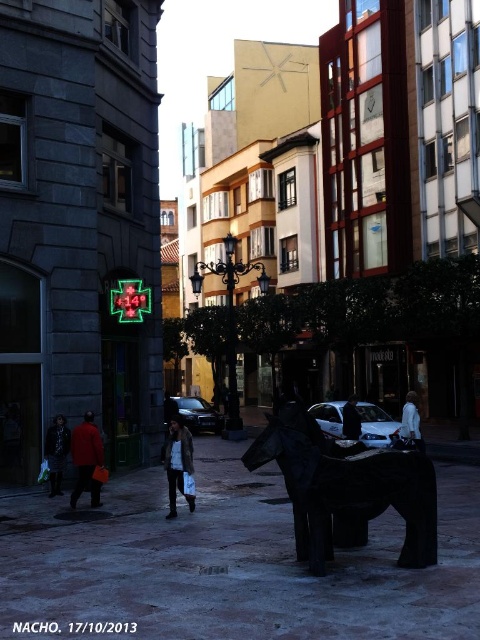
Is matte red coat at lower left above white matte coat at lower right?

Correct, matte red coat at lower left is located above white matte coat at lower right.

Can you confirm if matte red coat at lower left is positioned to the right of white matte coat at lower right?

In fact, matte red coat at lower left is to the left of white matte coat at lower right.

Is point (95, 449) farther from viewer compared to point (422, 449)?

That is False.

The image size is (480, 640). What are the coordinates of `matte red coat at lower left` in the screenshot? It's located at (86, 460).

Does matte red coat at lower left have a smaller size compared to leather jacket at center?

Correct, matte red coat at lower left occupies less space than leather jacket at center.

Does point (97, 492) come closer to viewer compared to point (179, 436)?

No.

Where is `matte red coat at lower left`? This screenshot has height=640, width=480. matte red coat at lower left is located at coordinates (86, 460).

Based on the photo, who is shorter, white matte coat at lower right or dark blue leather jacket at center?

Standing shorter between the two is dark blue leather jacket at center.

Who is taller, white matte coat at lower right or dark blue leather jacket at center?

white matte coat at lower right is taller.

In order to click on white matte coat at lower right in this screenshot , I will do `click(411, 422)`.

This screenshot has height=640, width=480. I want to click on white matte coat at lower right, so click(x=411, y=422).